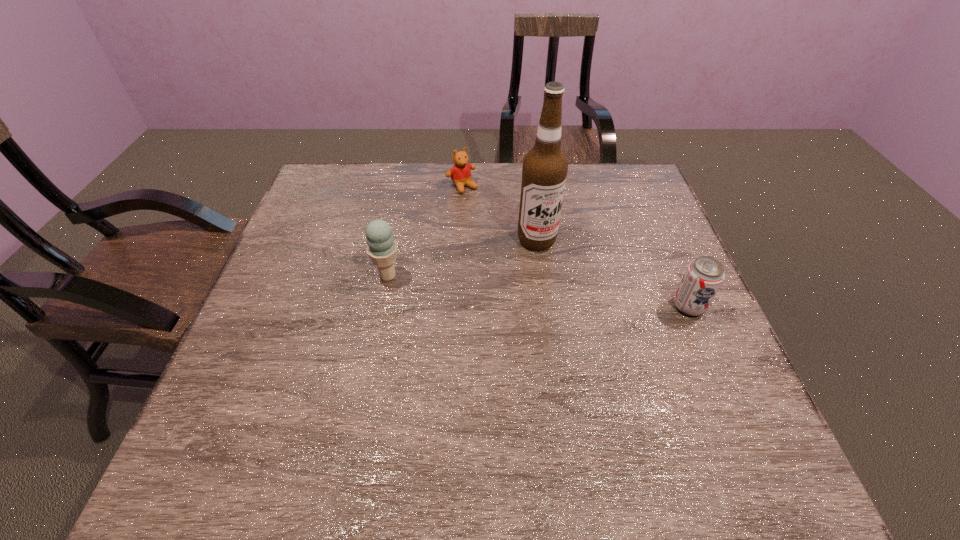
The image size is (960, 540). Identify the location of free space on the desktop that is between the ice cream and the nearest object and is positioned on the front-facing side of the teddy bear. (553, 293).

Identify the location of free spot on the desktop that is between the second nearest object and the rightmost object and is positioned on the label of the third object from left to right. (574, 295).